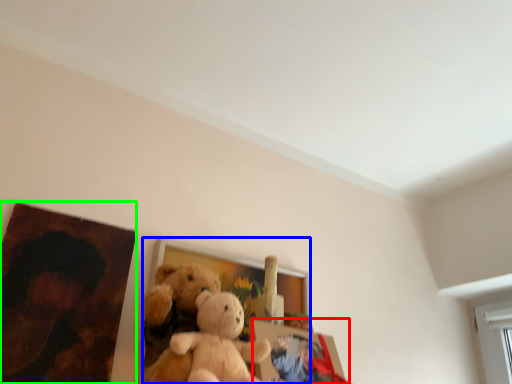
Question: Which is nearer to the picture frame (highlighted by a red box)? picture frame (highlighted by a blue box) or picture frame (highlighted by a green box).

Choices:
 (A) picture frame
 (B) picture frame

Answer: (A)